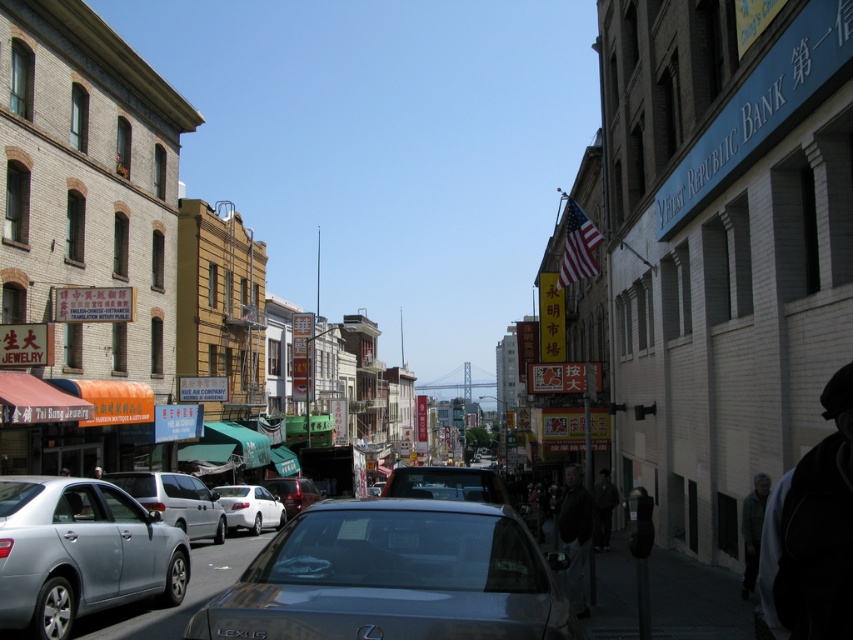
You are a delivery driver who needs to park your 6.5 feet tall truck in this area. You see a metallic gray sedan at center and a silver metallic sedan at lower left. Which vehicle should you avoid parking next to to ensure your truck fits vertically without hitting the roof?

You should avoid parking next to the silver metallic sedan at lower left because the metallic gray sedan at center is not as tall as the silver metallic sedan at lower left, meaning the silver metallic sedan at lower left has more vertical clearance for your truck.

You are standing at the point marked as point (0, 577) and want to walk to the point marked as point (456, 515). Given that both points are in the same street, which direction should you face to walk towards your destination?

You should face towards the direction of point (456, 515) because it is closer to you than point (0, 577), so walking towards it would be the correct direction.

You are a delivery driver trying to park your metallic gray sedan at center in this Chinatown area. The parking spot you want is located at coordinates point 0.903, 0.462. Can you confirm if your car is already parked in the desired spot?

The metallic gray sedan at center is already parked at point (393, 577), so yes, it is in the desired parking spot.